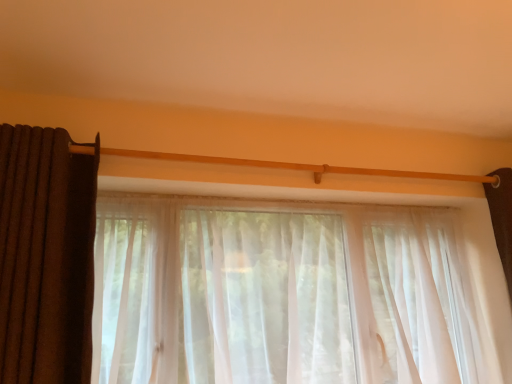
Measure the distance between point (28, 345) and camera.

Point (28, 345) is 1.18 meters from camera.

At what (x,y) coordinates should I click in order to perform the action: click on brown textured curtain at left, arranged as the second curtain when viewed from the right. Please return your answer as a coordinate pair (x, y). The image size is (512, 384). Looking at the image, I should click on (46, 255).

What do you see at coordinates (46, 255) in the screenshot? The width and height of the screenshot is (512, 384). I see `brown textured curtain at left, the 1th curtain positioned from the left` at bounding box center [46, 255].

Describe the element at coordinates (46, 255) in the screenshot. I see `sheer white curtain at center, marked as the 2th curtain in a left-to-right arrangement` at that location.

Locate an element on the screen. The height and width of the screenshot is (384, 512). sheer white curtain at center, which is the first curtain in right-to-left order is located at coordinates (46, 255).

Measure the distance between point [20,349] and camera.

The depth of point [20,349] is 3.85 feet.

Locate an element on the screen. This screenshot has height=384, width=512. brown textured curtain at left, the 1th curtain positioned from the left is located at coordinates (46, 255).

Is sheer white curtain at center, marked as the 2th curtain in a left-to-right arrangement, to the left or to the right of brown textured curtain at left, arranged as the second curtain when viewed from the right, in the image?

Based on their positions, sheer white curtain at center, marked as the 2th curtain in a left-to-right arrangement, is located to the right of brown textured curtain at left, arranged as the second curtain when viewed from the right.

Which is behind, sheer white curtain at center, marked as the 2th curtain in a left-to-right arrangement, or brown textured curtain at left, arranged as the second curtain when viewed from the right?

sheer white curtain at center, marked as the 2th curtain in a left-to-right arrangement, is further away from the camera.

Is point (4, 184) farther from viewer compared to point (45, 367)?

Yes, point (4, 184) is behind point (45, 367).

In the scene shown: From the image's perspective, which is below, sheer white curtain at center, which is the first curtain in right-to-left order, or brown textured curtain at left, arranged as the second curtain when viewed from the right?

sheer white curtain at center, which is the first curtain in right-to-left order, appears lower in the image.

From a real-world perspective, which is physically above, sheer white curtain at center, marked as the 2th curtain in a left-to-right arrangement, or brown textured curtain at left, arranged as the second curtain when viewed from the right?

brown textured curtain at left, arranged as the second curtain when viewed from the right, is physically above.

Which of these two, sheer white curtain at center, marked as the 2th curtain in a left-to-right arrangement, or brown textured curtain at left, arranged as the second curtain when viewed from the right, is wider?

sheer white curtain at center, marked as the 2th curtain in a left-to-right arrangement, is wider.

Does sheer white curtain at center, marked as the 2th curtain in a left-to-right arrangement, have a lesser height compared to brown textured curtain at left, the 1th curtain positioned from the left?

Incorrect, the height of sheer white curtain at center, marked as the 2th curtain in a left-to-right arrangement, does not fall short of that of brown textured curtain at left, the 1th curtain positioned from the left.

Who is bigger, sheer white curtain at center, which is the first curtain in right-to-left order, or brown textured curtain at left, arranged as the second curtain when viewed from the right?

Bigger between the two is sheer white curtain at center, which is the first curtain in right-to-left order.

Looking at this image, is sheer white curtain at center, which is the first curtain in right-to-left order, surrounding brown textured curtain at left, the 1th curtain positioned from the left?

Definitely not — brown textured curtain at left, the 1th curtain positioned from the left, is not inside sheer white curtain at center, which is the first curtain in right-to-left order.

Looking at this image, can you see sheer white curtain at center, marked as the 2th curtain in a left-to-right arrangement, touching brown textured curtain at left, arranged as the second curtain when viewed from the right?

Yes, sheer white curtain at center, marked as the 2th curtain in a left-to-right arrangement, is touching brown textured curtain at left, arranged as the second curtain when viewed from the right.

Is sheer white curtain at center, marked as the 2th curtain in a left-to-right arrangement, oriented towards brown textured curtain at left, the 1th curtain positioned from the left?

No.

The image size is (512, 384). What are the coordinates of `curtain lying above the sheer white curtain at center, marked as the 2th curtain in a left-to-right arrangement (from the image's perspective)` in the screenshot? It's located at (46, 255).

Does brown textured curtain at left, arranged as the second curtain when viewed from the right, appear on the left side of sheer white curtain at center, marked as the 2th curtain in a left-to-right arrangement?

Yes, brown textured curtain at left, arranged as the second curtain when viewed from the right, is to the left of sheer white curtain at center, marked as the 2th curtain in a left-to-right arrangement.

Which is behind, brown textured curtain at left, the 1th curtain positioned from the left, or sheer white curtain at center, which is the first curtain in right-to-left order?

Positioned behind is sheer white curtain at center, which is the first curtain in right-to-left order.

Is point (78, 345) in front of point (30, 204)?

No.

From the image's perspective, which is above, brown textured curtain at left, arranged as the second curtain when viewed from the right, or sheer white curtain at center, marked as the 2th curtain in a left-to-right arrangement?

brown textured curtain at left, arranged as the second curtain when viewed from the right, from the image's perspective.

From a real-world perspective, is brown textured curtain at left, arranged as the second curtain when viewed from the right, positioned under sheer white curtain at center, marked as the 2th curtain in a left-to-right arrangement, based on gravity?

Incorrect, from a real-world perspective, brown textured curtain at left, arranged as the second curtain when viewed from the right, is higher than sheer white curtain at center, marked as the 2th curtain in a left-to-right arrangement.

Is brown textured curtain at left, the 1th curtain positioned from the left, thinner than sheer white curtain at center, marked as the 2th curtain in a left-to-right arrangement?

Yes, brown textured curtain at left, the 1th curtain positioned from the left, is thinner than sheer white curtain at center, marked as the 2th curtain in a left-to-right arrangement.

In terms of height, does brown textured curtain at left, arranged as the second curtain when viewed from the right, look taller or shorter compared to sheer white curtain at center, marked as the 2th curtain in a left-to-right arrangement?

Clearly, brown textured curtain at left, arranged as the second curtain when viewed from the right, is shorter compared to sheer white curtain at center, marked as the 2th curtain in a left-to-right arrangement.

Considering the sizes of brown textured curtain at left, the 1th curtain positioned from the left, and sheer white curtain at center, which is the first curtain in right-to-left order, in the image, is brown textured curtain at left, the 1th curtain positioned from the left, bigger or smaller than sheer white curtain at center, which is the first curtain in right-to-left order,?

brown textured curtain at left, the 1th curtain positioned from the left, is smaller than sheer white curtain at center, which is the first curtain in right-to-left order.

Is brown textured curtain at left, the 1th curtain positioned from the left, situated inside sheer white curtain at center, which is the first curtain in right-to-left order, or outside?

brown textured curtain at left, the 1th curtain positioned from the left, is spatially situated outside sheer white curtain at center, which is the first curtain in right-to-left order.

Are brown textured curtain at left, arranged as the second curtain when viewed from the right, and sheer white curtain at center, which is the first curtain in right-to-left order, far apart?

No, brown textured curtain at left, arranged as the second curtain when viewed from the right, is not far away from sheer white curtain at center, which is the first curtain in right-to-left order.

Is brown textured curtain at left, arranged as the second curtain when viewed from the right, aimed at sheer white curtain at center, which is the first curtain in right-to-left order?

No, brown textured curtain at left, arranged as the second curtain when viewed from the right, does not turn towards sheer white curtain at center, which is the first curtain in right-to-left order.

Could you measure the distance between brown textured curtain at left, arranged as the second curtain when viewed from the right, and sheer white curtain at center, marked as the 2th curtain in a left-to-right arrangement?

brown textured curtain at left, arranged as the second curtain when viewed from the right, is 0.41 inches away from sheer white curtain at center, marked as the 2th curtain in a left-to-right arrangement.

Find the location of a particular element. The image size is (512, 384). curtain on the left of sheer white curtain at center, which is the first curtain in right-to-left order is located at coordinates (46, 255).

Locate an element on the screen. Image resolution: width=512 pixels, height=384 pixels. curtain behind the brown textured curtain at left, arranged as the second curtain when viewed from the right is located at coordinates (46, 255).

The width and height of the screenshot is (512, 384). In order to click on curtain that appears on the right of brown textured curtain at left, arranged as the second curtain when viewed from the right in this screenshot , I will do `click(46, 255)`.